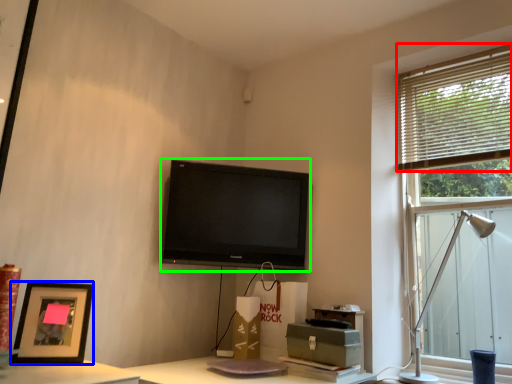
Question: Considering the real-world distances, which object is closest to blind (highlighted by a red box)? picture frame (highlighted by a blue box) or television (highlighted by a green box).

Choices:
 (A) picture frame
 (B) television

Answer: (B)